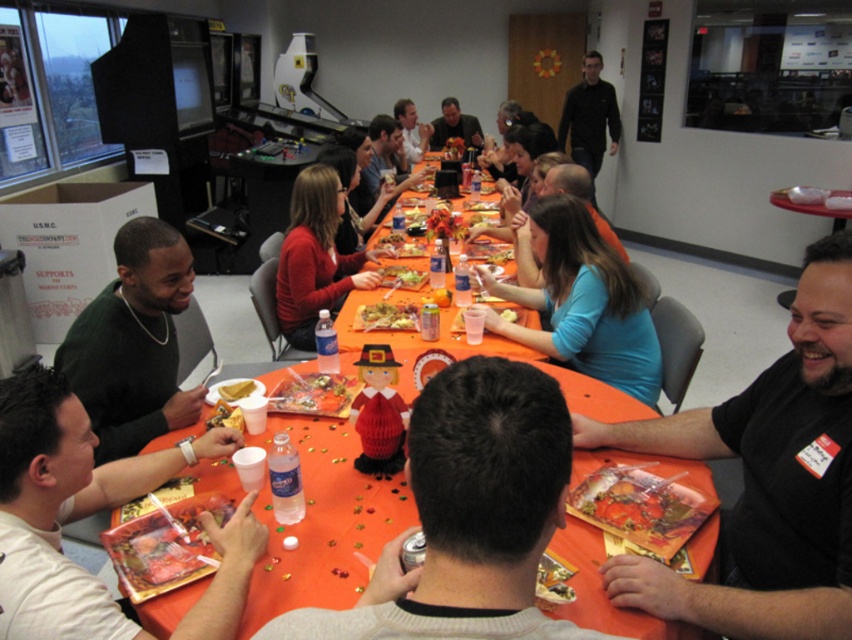
Question: Does white matte plastic cup at lower left appear on the left side of shiny plastic plate at center?

Choices:
 (A) yes
 (B) no

Answer: (A)

Question: Is orange fabric table at center smaller than golden paper bag at center?

Choices:
 (A) yes
 (B) no

Answer: (B)

Question: Is translucent plastic bag at center in front of matte orange plate at center?

Choices:
 (A) yes
 (B) no

Answer: (A)

Question: Which object is positioned closest to the matte orange plate at center?

Choices:
 (A) matte black sweater at upper center
 (B) orange matte pumpkin at center
 (C) smooth white bread at center
 (D) white matte plastic cup at lower left

Answer: (B)

Question: Which of the following is the farthest from the observer?

Choices:
 (A) (59, 410)
 (B) (125, 524)
 (C) (452, 108)
 (D) (413, 104)

Answer: (C)

Question: Which point is closer to the camera?

Choices:
 (A) (127, 548)
 (B) (509, 256)
 (C) (393, 317)
 (D) (406, 262)

Answer: (A)